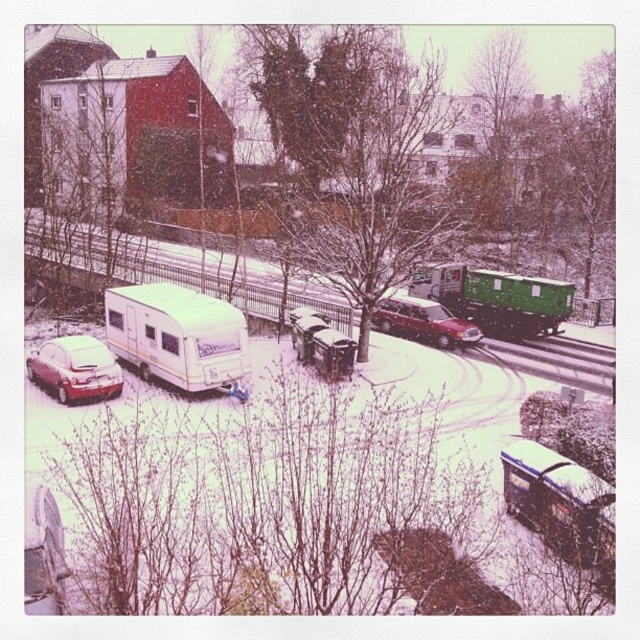
Question: Which object is positioned farthest from the metallic red car at center?

Choices:
 (A) matte red car at lower left
 (B) metallic silver trailer at lower right
 (C) green matte trailer at center

Answer: (A)

Question: Which point is closer to the camera taking this photo?

Choices:
 (A) (556, 323)
 (B) (538, 346)

Answer: (B)

Question: Which object appears farthest from the camera in this image?

Choices:
 (A) metallic silver trailer at lower right
 (B) green matte trailer at center
 (C) matte red car at lower left

Answer: (B)

Question: Is matte red car at lower left wider than metallic red car at center?

Choices:
 (A) yes
 (B) no

Answer: (B)

Question: Does green matte trailer at center have a greater width compared to matte red car at lower left?

Choices:
 (A) no
 (B) yes

Answer: (B)

Question: Does white glossy caravan at center-left appear on the right side of metal train track at center?

Choices:
 (A) yes
 (B) no

Answer: (B)